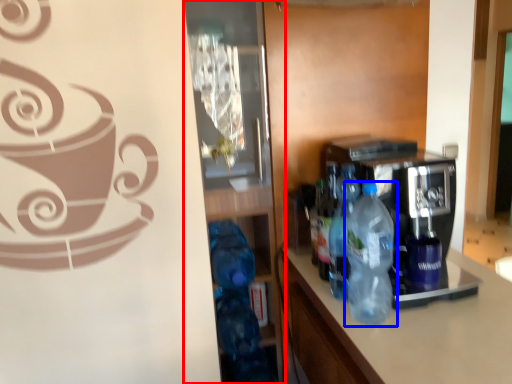
Question: Which object appears closest to the camera in this image, glass door (highlighted by a red box) or bottle (highlighted by a blue box)?

Choices:
 (A) glass door
 (B) bottle

Answer: (B)